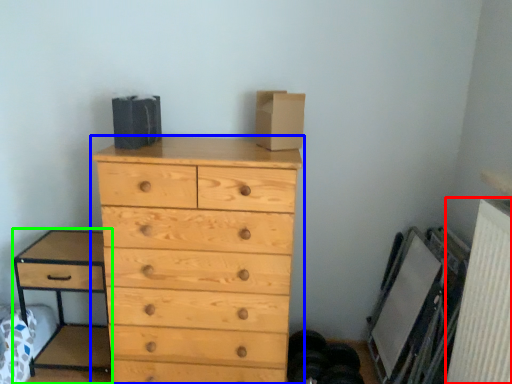
Question: Based on their relative distances, which object is nearer to radiator (highlighted by a red box)? Choose from chest of drawers (highlighted by a blue box) and nightstand (highlighted by a green box).

Choices:
 (A) chest of drawers
 (B) nightstand

Answer: (A)